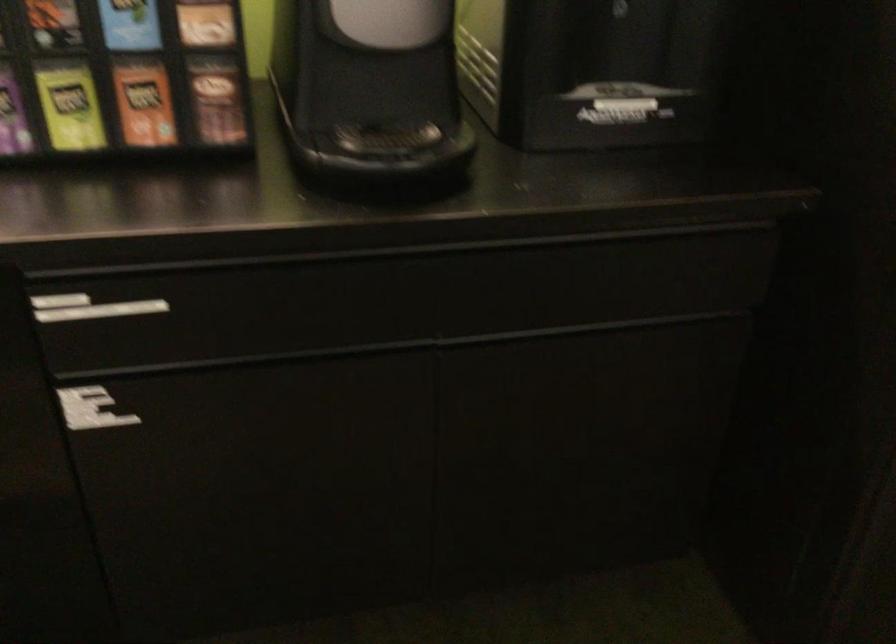
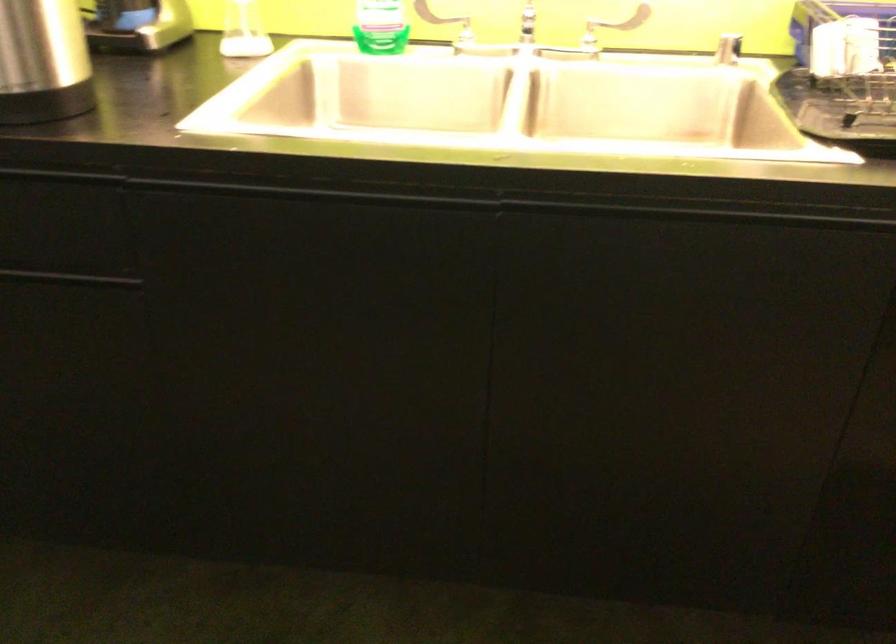
Question: The images are taken continuously from a first-person perspective. In which direction are you moving?

Choices:
 (A) Left
 (B) Right
 (C) Forward
 (D) Backward

Answer: (A)